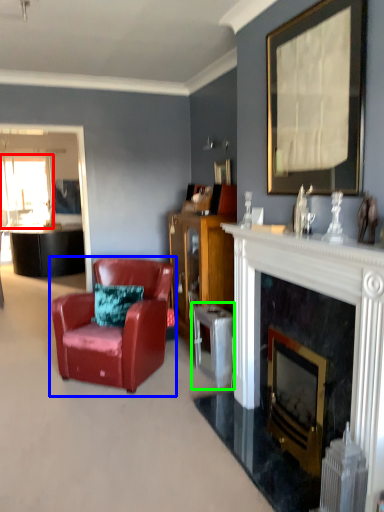
Question: Estimate the real-world distances between objects in this image. Which object is closer to window screen (highlighted by a red box), chair (highlighted by a blue box) or table (highlighted by a green box)?

Choices:
 (A) chair
 (B) table

Answer: (A)